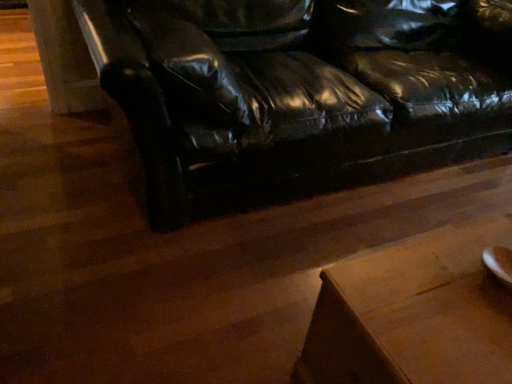
Question: Is black leather couch at center further to the viewer compared to wooden table at lower right?

Choices:
 (A) yes
 (B) no

Answer: (A)

Question: Is black leather couch at center taller than wooden table at lower right?

Choices:
 (A) no
 (B) yes

Answer: (B)

Question: Can you confirm if black leather couch at center is shorter than wooden table at lower right?

Choices:
 (A) yes
 (B) no

Answer: (B)

Question: Does black leather couch at center have a smaller size compared to wooden table at lower right?

Choices:
 (A) no
 (B) yes

Answer: (A)

Question: Is black leather couch at center oriented towards wooden table at lower right?

Choices:
 (A) yes
 (B) no

Answer: (A)

Question: Can wooden table at lower right be found inside black leather couch at center?

Choices:
 (A) no
 (B) yes

Answer: (A)

Question: Does wooden table at lower right turn towards black leather couch at center?

Choices:
 (A) no
 (B) yes

Answer: (A)

Question: From a real-world perspective, is wooden table at lower right physically above black leather couch at center?

Choices:
 (A) no
 (B) yes

Answer: (A)

Question: Is wooden table at lower right wider than black leather couch at center?

Choices:
 (A) no
 (B) yes

Answer: (A)

Question: Does wooden table at lower right have a lesser height compared to black leather couch at center?

Choices:
 (A) yes
 (B) no

Answer: (A)

Question: Does wooden table at lower right have a larger size compared to black leather couch at center?

Choices:
 (A) no
 (B) yes

Answer: (A)

Question: Can you confirm if wooden table at lower right is positioned to the right of black leather couch at center?

Choices:
 (A) no
 (B) yes

Answer: (B)

Question: Is black leather couch at center situated inside wooden table at lower right or outside?

Choices:
 (A) inside
 (B) outside

Answer: (B)